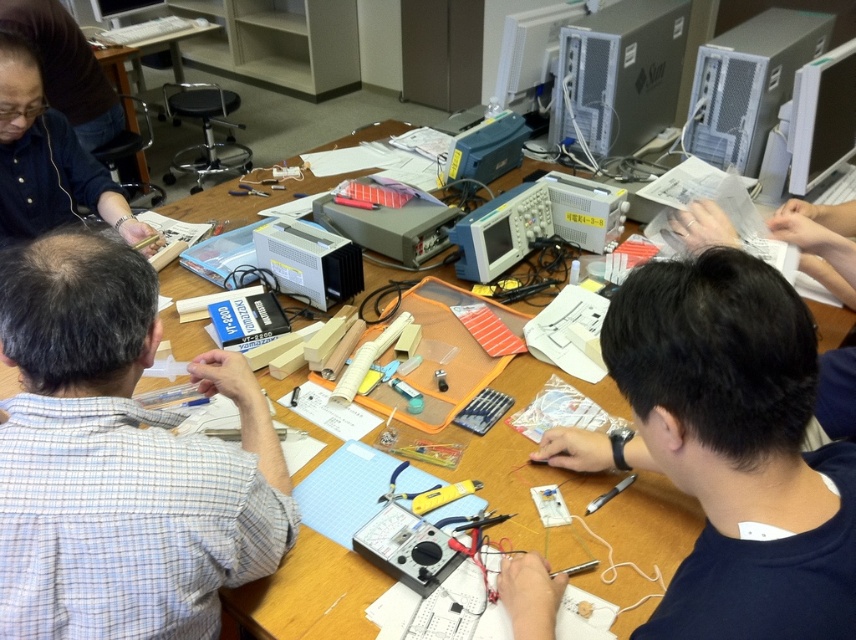
Looking at this image, between matte black shirt at upper left and gray metallic computer at upper right, which one is positioned higher?

Positioned higher is gray metallic computer at upper right.

Does matte black shirt at upper left have a lesser width compared to gray metallic computer at upper right?

Yes.

Who is more forward, [70,208] or [729,116]?

Point [70,208] is in front.

You are a GUI agent. You are given a task and a screenshot of the screen. Output one action in this format:
    pyautogui.click(x=<x>, y=<y>)
    Task: Click on the matte black shirt at upper left
    
    Given the screenshot: What is the action you would take?
    pyautogui.click(x=48, y=163)

Who is more distant from viewer, (443, 429) or (138, 68)?

The point (138, 68) is behind.

Who is positioned more to the left, wooden table at center or wooden table at upper left?

Positioned to the left is wooden table at upper left.

Describe the element at coordinates (307, 595) in the screenshot. The image size is (856, 640). I see `wooden table at center` at that location.

Where is `wooden table at center`? The height and width of the screenshot is (640, 856). wooden table at center is located at coordinates (307, 595).

Is wooden table at center closer to camera compared to satin silver computer at upper center?

Yes, wooden table at center is closer to the viewer.

Where is `wooden table at center`? wooden table at center is located at coordinates (307, 595).